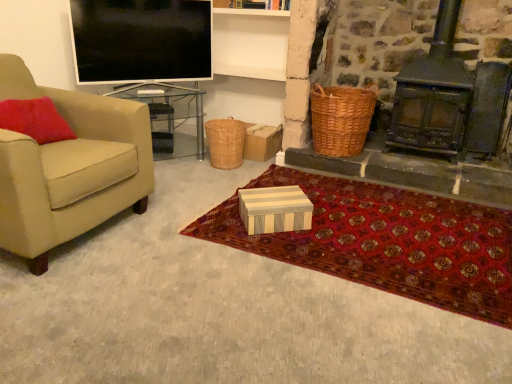
What is the approximate height of black metal fireplace at right?

black metal fireplace at right is 37.72 inches tall.

What is the approximate width of woven brown picnic basket at center, marked as the first picnic basket in a left-to-right arrangement?

woven brown picnic basket at center, marked as the first picnic basket in a left-to-right arrangement, is 32.06 centimeters in width.

The width and height of the screenshot is (512, 384). What do you see at coordinates (162, 142) in the screenshot?
I see `white striped cardboard box at center, arranged as the 2th box when ordered from the bottom` at bounding box center [162, 142].

Identify the location of flat screen tv at upper left. (141, 40).

Where is `red carpet at center`? The image size is (512, 384). red carpet at center is located at coordinates (386, 242).

This screenshot has width=512, height=384. What do you see at coordinates (386, 242) in the screenshot? I see `red carpet at center` at bounding box center [386, 242].

This screenshot has width=512, height=384. I want to click on black metal fireplace at right, so click(449, 98).

Which object is positioned more to the right, white striped wood box at center, arranged as the first box when viewed from the front, or black metal fireplace at right?

black metal fireplace at right.

From their relative heights in the image, would you say white striped wood box at center, the 2th box in the top-to-bottom sequence, is taller or shorter than black metal fireplace at right?

white striped wood box at center, the 2th box in the top-to-bottom sequence, is shorter than black metal fireplace at right.

Could you tell me if white striped wood box at center, positioned as the 1th box in bottom-to-top order, is turned towards black metal fireplace at right?

No, white striped wood box at center, positioned as the 1th box in bottom-to-top order, does not turn towards black metal fireplace at right.

Choose the correct answer: Is white striped wood box at center, the 2th box in the top-to-bottom sequence, inside black metal fireplace at right or outside it?

white striped wood box at center, the 2th box in the top-to-bottom sequence, is not enclosed by black metal fireplace at right.

Is point (452, 219) behind point (152, 138)?

No, (452, 219) is in front of (152, 138).

Is red carpet at center far away from white striped cardboard box at center, the first box viewed from the top?

red carpet at center is positioned a significant distance from white striped cardboard box at center, the first box viewed from the top.

From the image's perspective, is red carpet at center beneath white striped cardboard box at center, which ranks as the second box in right-to-left order?

Yes.

Is red carpet at center bigger than white striped cardboard box at center, arranged as the 2th box when ordered from the bottom?

Yes.

Considering the relative sizes of woven brown picnic basket at center, marked as the first picnic basket in a left-to-right arrangement, and woven brown picnic basket at right, which ranks as the first picnic basket in right-to-left order, in the image provided, is woven brown picnic basket at center, marked as the first picnic basket in a left-to-right arrangement, thinner than woven brown picnic basket at right, which ranks as the first picnic basket in right-to-left order,?

Yes, woven brown picnic basket at center, marked as the first picnic basket in a left-to-right arrangement, is thinner than woven brown picnic basket at right, which ranks as the first picnic basket in right-to-left order.

Considering the points (240, 125) and (359, 137), which point is behind, point (240, 125) or point (359, 137)?

The point (240, 125) is behind.

Which is more to the right, woven brown picnic basket at center, marked as the first picnic basket in a left-to-right arrangement, or woven brown picnic basket at right, the second picnic basket viewed from the left?

woven brown picnic basket at right, the second picnic basket viewed from the left, is more to the right.

Which of these two, woven brown picnic basket at center, marked as the first picnic basket in a left-to-right arrangement, or woven brown picnic basket at right, which ranks as the first picnic basket in right-to-left order, is smaller?

With smaller size is woven brown picnic basket at center, marked as the first picnic basket in a left-to-right arrangement.

Can you confirm if black metal fireplace at right is positioned to the left of white striped wood box at center, placed as the second box when sorted from left to right?

No.

In the scene shown: Is white striped wood box at center, which ranks as the second box in back-to-front order, inside black metal fireplace at right?

Definitely not — white striped wood box at center, which ranks as the second box in back-to-front order, is not inside black metal fireplace at right.

From the image's perspective, is black metal fireplace at right beneath white striped wood box at center, positioned as the 1th box in bottom-to-top order?

No, from the image's perspective, black metal fireplace at right is not below white striped wood box at center, positioned as the 1th box in bottom-to-top order.

Is black metal fireplace at right aimed at white striped wood box at center, which ranks as the 1th box in right-to-left order?

No, black metal fireplace at right is not aimed at white striped wood box at center, which ranks as the 1th box in right-to-left order.

Can you see flat screen tv at upper left touching white striped cardboard box at center, which ranks as the second box in right-to-left order?

No, flat screen tv at upper left is not with white striped cardboard box at center, which ranks as the second box in right-to-left order.

Who is taller, flat screen tv at upper left or white striped cardboard box at center, which ranks as the second box in right-to-left order?

With more height is flat screen tv at upper left.

Which is more to the right, flat screen tv at upper left or white striped cardboard box at center, the 1th box from the back?

From the viewer's perspective, white striped cardboard box at center, the 1th box from the back, appears more on the right side.

Is flat screen tv at upper left located outside white striped cardboard box at center, the first box viewed from the top?

Indeed, flat screen tv at upper left is completely outside white striped cardboard box at center, the first box viewed from the top.

From the image's perspective, who appears lower, transparent glass table at left or flat screen tv at upper left?

transparent glass table at left.

Is transparent glass table at left touching flat screen tv at upper left?

No, transparent glass table at left is not in contact with flat screen tv at upper left.

From a real-world perspective, is transparent glass table at left positioned over flat screen tv at upper left based on gravity?

No, from a real-world perspective, transparent glass table at left is not on top of flat screen tv at upper left.

Considering the relative sizes of transparent glass table at left and flat screen tv at upper left in the image provided, is transparent glass table at left wider than flat screen tv at upper left?

Yes, transparent glass table at left is wider than flat screen tv at upper left.

Which is behind, black metal fireplace at right or red carpet at center?

black metal fireplace at right is further from the camera.

From a real-world perspective, who is located lower, black metal fireplace at right or red carpet at center?

From a 3D spatial view, red carpet at center is below.

Is black metal fireplace at right at the right side of red carpet at center?

Yes.

Is red carpet at center located within black metal fireplace at right?

Actually, red carpet at center is outside black metal fireplace at right.

Where is `box in front of the black metal fireplace at right`? This screenshot has width=512, height=384. box in front of the black metal fireplace at right is located at coordinates (275, 209).

This screenshot has width=512, height=384. In order to click on mat directly beneath the white striped cardboard box at center, the first box in the left-to-right sequence (from a real-world perspective) in this screenshot , I will do (386, 242).

When comparing their distances from white striped cardboard box at center, the 1th box from the back, does woven brown picnic basket at right, which ranks as the first picnic basket in right-to-left order, or woven brown picnic basket at center, the 2th picnic basket positioned from the right, seem closer?

The object closer to white striped cardboard box at center, the 1th box from the back, is woven brown picnic basket at center, the 2th picnic basket positioned from the right.

Estimate the real-world distances between objects in this image. Which object is closer to flat screen tv at upper left, woven brown picnic basket at center, the 2th picnic basket positioned from the right, or beige fabric chair at left?

woven brown picnic basket at center, the 2th picnic basket positioned from the right, is positioned closer to the anchor flat screen tv at upper left.

From the image, which object appears to be nearer to beige fabric chair at left, woven brown picnic basket at center, marked as the first picnic basket in a left-to-right arrangement, or black metal fireplace at right?

Based on the image, woven brown picnic basket at center, marked as the first picnic basket in a left-to-right arrangement, appears to be nearer to beige fabric chair at left.

Looking at the image, which one is located closer to woven brown picnic basket at right, the second picnic basket viewed from the left, transparent glass table at left or red carpet at center?

The object closer to woven brown picnic basket at right, the second picnic basket viewed from the left, is red carpet at center.

When comparing their distances from woven brown picnic basket at center, the 2th picnic basket positioned from the right, does white striped wood box at center, which ranks as the second box in back-to-front order, or woven brown picnic basket at right, which ranks as the first picnic basket in right-to-left order, seem further?

The object further to woven brown picnic basket at center, the 2th picnic basket positioned from the right, is white striped wood box at center, which ranks as the second box in back-to-front order.

Based on their spatial positions, is white striped cardboard box at center, the 1th box from the back, or woven brown picnic basket at right, the second picnic basket viewed from the left, closer to beige fabric chair at left?

white striped cardboard box at center, the 1th box from the back, is closer to beige fabric chair at left.

Which object lies further to the anchor point beige fabric chair at left, white striped cardboard box at center, arranged as the 2th box when ordered from the bottom, or transparent glass table at left?

The object further to beige fabric chair at left is white striped cardboard box at center, arranged as the 2th box when ordered from the bottom.

Considering their positions, is white striped cardboard box at center, the first box viewed from the top, positioned further to beige fabric chair at left than white striped wood box at center, placed as the second box when sorted from left to right?

white striped cardboard box at center, the first box viewed from the top, is positioned further to the anchor beige fabric chair at left.

Locate an element on the screen. The image size is (512, 384). box between woven brown picnic basket at center, marked as the first picnic basket in a left-to-right arrangement, and black metal fireplace at right, in the horizontal direction is located at coordinates (275, 209).

You are a GUI agent. You are given a task and a screenshot of the screen. Output one action in this format:
    pyautogui.click(x=<x>, y=<y>)
    Task: Click on the television between transparent glass table at left and red carpet at center
    The image size is (512, 384).
    Given the screenshot: What is the action you would take?
    pyautogui.click(x=141, y=40)

The height and width of the screenshot is (384, 512). Find the location of `picnic basket located between beige fabric chair at left and red carpet at center in the left-right direction`. picnic basket located between beige fabric chair at left and red carpet at center in the left-right direction is located at coordinates pos(225,142).

The image size is (512, 384). I want to click on table between beige fabric chair at left and black metal fireplace at right from left to right, so click(x=169, y=117).